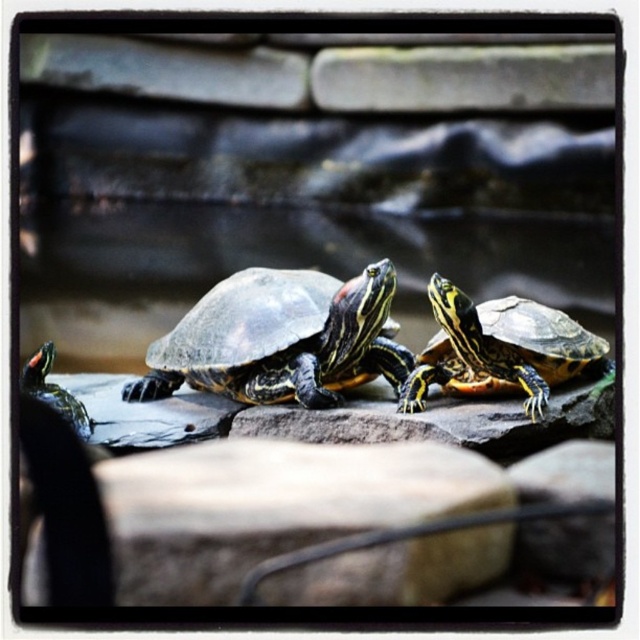
You are a photographer aiming to capture the shiny green tortoise at center in your shot. Based on its coordinates, where should you focus your camera to ensure it is centered in the frame?

To center the shiny green tortoise at center in your frame, focus your camera at the coordinates point mentioned in the Objects Description, which is point at [280,339].

You are a wildlife photographer aiming to capture the shiny green tortoise at center and the shiny green shell at center in a single frame. Given that your camera has a limited focus range, which object should you focus on to ensure it appears clearer in the photo?

The shiny green tortoise at center is larger compared to the shiny green shell at center, so focusing on the shiny green tortoise at center would ensure it appears clearer in the photo.